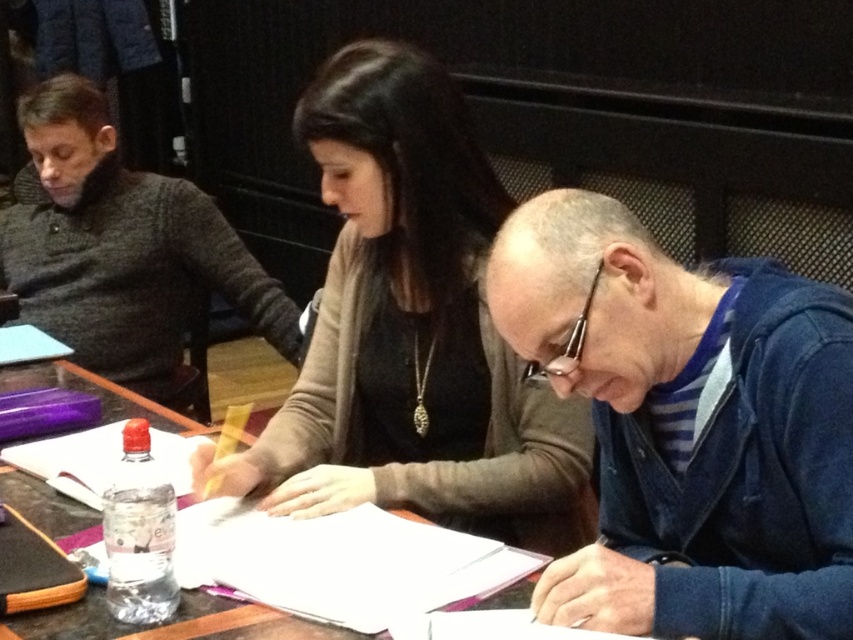
Question: Can you confirm if blue denim jacket at lower right is thinner than wooden table at center?

Choices:
 (A) no
 (B) yes

Answer: (B)

Question: Among these points, which one is nearest to the camera?

Choices:
 (A) [x=117, y=308]
 (B) [x=282, y=488]

Answer: (B)

Question: In this image, where is blue denim jacket at lower right located relative to wooden table at center?

Choices:
 (A) left
 (B) right

Answer: (B)

Question: Which point is closer to the camera?

Choices:
 (A) dark gray sweater at left
 (B) wooden table at center

Answer: (B)

Question: Is blue denim jacket at lower right to the right of matte black sweater at center from the viewer's perspective?

Choices:
 (A) no
 (B) yes

Answer: (B)

Question: Based on their relative distances, which object is farther from the dark gray sweater at left?

Choices:
 (A) wooden table at center
 (B) matte black sweater at center

Answer: (A)